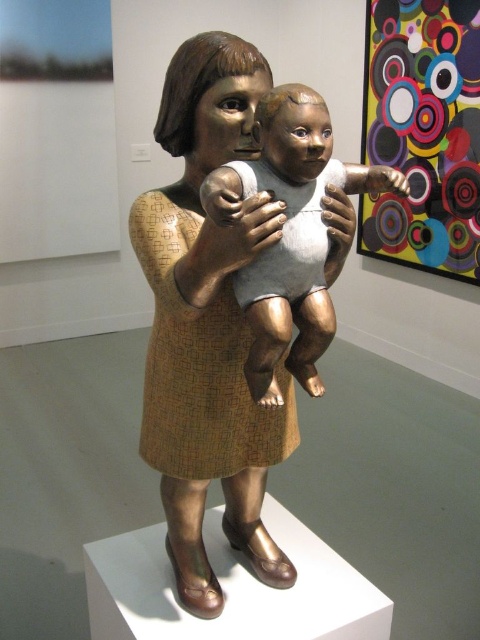
Question: Considering the relative positions of bronze statue at center and multicolored concentric circles on canvas at upper right in the image provided, where is bronze statue at center located with respect to multicolored concentric circles on canvas at upper right?

Choices:
 (A) right
 (B) left

Answer: (B)

Question: From the image, what is the correct spatial relationship of multicolored concentric circles on canvas at upper right in relation to matte white baby at center?

Choices:
 (A) above
 (B) below

Answer: (A)

Question: Among these objects, which one is nearest to the camera?

Choices:
 (A) bronze statue at center
 (B) multicolored concentric circles on canvas at upper right
 (C) matte white baby at center

Answer: (C)

Question: Is bronze statue at center further to camera compared to multicolored concentric circles on canvas at upper right?

Choices:
 (A) yes
 (B) no

Answer: (B)

Question: Which of the following is the farthest from the observer?

Choices:
 (A) matte white baby at center
 (B) multicolored concentric circles on canvas at upper right
 (C) bronze statue at center

Answer: (B)

Question: Among these points, which one is nearest to the camera?

Choices:
 (A) (181, 392)
 (B) (454, 65)
 (C) (278, 300)

Answer: (C)